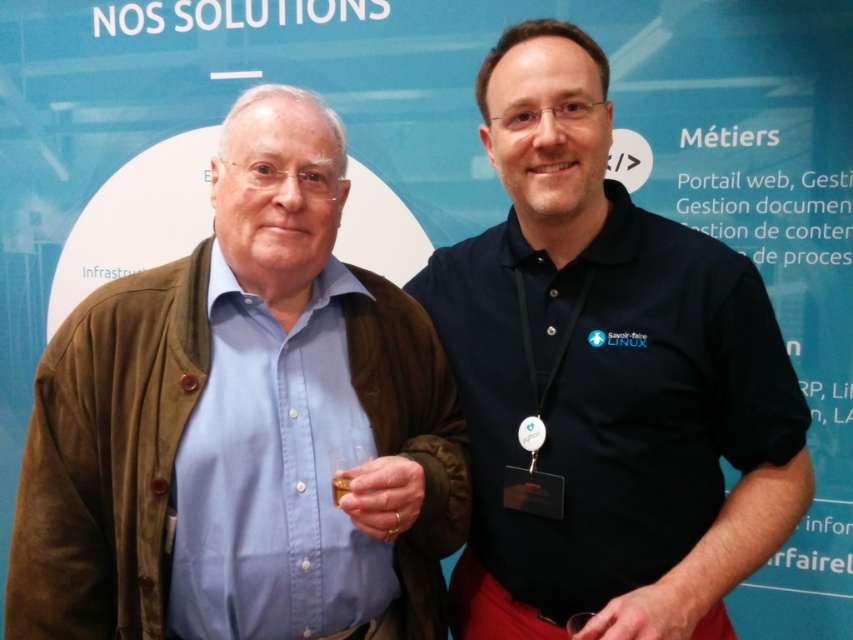
From the picture: Is blue cotton shirt at left bigger than silver metallic medal at center?

Correct, blue cotton shirt at left is larger in size than silver metallic medal at center.

Can you confirm if blue cotton shirt at left is shorter than silver metallic medal at center?

No, blue cotton shirt at left is not shorter than silver metallic medal at center.

Identify the location of blue cotton shirt at left. (242, 426).

Identify the location of blue cotton shirt at left. (242, 426).

Who is more forward, (59, 516) or (660, 595)?

Point (660, 595) is more forward.

What do you see at coordinates (242, 426) in the screenshot? I see `blue cotton shirt at left` at bounding box center [242, 426].

Locate an element on the screen. The image size is (853, 640). blue cotton shirt at left is located at coordinates (242, 426).

You are a GUI agent. You are given a task and a screenshot of the screen. Output one action in this format:
    pyautogui.click(x=<x>, y=<y>)
    Task: Click on the blue cotton shirt at left
    This screenshot has width=853, height=640.
    Given the screenshot: What is the action you would take?
    pyautogui.click(x=242, y=426)

From the picture: Can you confirm if dark blue shirt at center is thinner than silver metallic medal at center?

No, dark blue shirt at center is not thinner than silver metallic medal at center.

Between dark blue shirt at center and silver metallic medal at center, which one has more height?

Standing taller between the two is dark blue shirt at center.

Describe the element at coordinates (605, 380) in the screenshot. The height and width of the screenshot is (640, 853). I see `dark blue shirt at center` at that location.

Find the location of `dark blue shirt at center`. dark blue shirt at center is located at coordinates (605, 380).